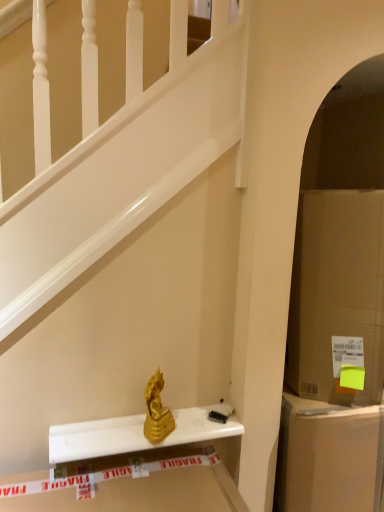
Image resolution: width=384 pixels, height=512 pixels. Identify the location of blank space situated above gold metallic statue at center (from a real-world perspective). (130, 426).